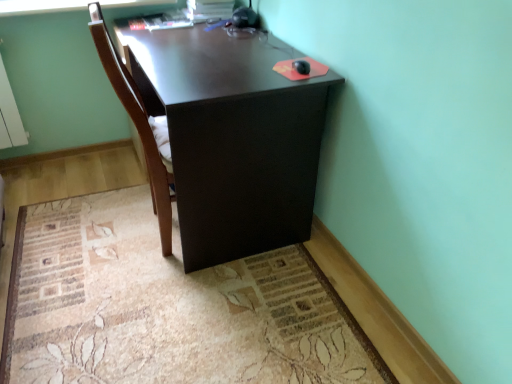
Question: From the image's perspective, is dark wood desk at center located above or below brown wood chair at center?

Choices:
 (A) below
 (B) above

Answer: (B)

Question: Is dark wood desk at center to the left or to the right of brown wood chair at center in the image?

Choices:
 (A) right
 (B) left

Answer: (A)

Question: Estimate the real-world distances between objects in this image. Which object is farther from the brown wood chair at center?

Choices:
 (A) beige carpet at lower center
 (B) dark wood desk at center

Answer: (A)

Question: Considering the real-world distances, which object is closest to the brown wood chair at center?

Choices:
 (A) beige carpet at lower center
 (B) dark wood desk at center

Answer: (B)